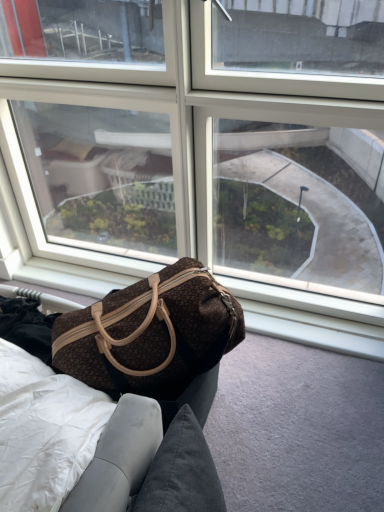
Question: Considering the relative sizes of brown textured fabric bag at center and brown fabric bag at lower left in the image provided, is brown textured fabric bag at center shorter than brown fabric bag at lower left?

Choices:
 (A) yes
 (B) no

Answer: (B)

Question: Is brown textured fabric bag at center to the left of brown fabric bag at lower left from the viewer's perspective?

Choices:
 (A) yes
 (B) no

Answer: (A)

Question: Can you confirm if brown textured fabric bag at center is thinner than brown fabric bag at lower left?

Choices:
 (A) yes
 (B) no

Answer: (A)

Question: Is brown textured fabric bag at center positioned before brown fabric bag at lower left?

Choices:
 (A) no
 (B) yes

Answer: (B)

Question: Does brown textured fabric bag at center have a larger size compared to brown fabric bag at lower left?

Choices:
 (A) no
 (B) yes

Answer: (B)

Question: From a real-world perspective, is transparent glass window at center physically located above or below brown textured fabric bag at center?

Choices:
 (A) above
 (B) below

Answer: (A)

Question: In terms of width, does transparent glass window at center look wider or thinner when compared to brown textured fabric bag at center?

Choices:
 (A) wide
 (B) thin

Answer: (B)

Question: Is point (168, 28) positioned closer to the camera than point (203, 301)?

Choices:
 (A) closer
 (B) farther

Answer: (B)

Question: From the image's perspective, is transparent glass window at center located above or below brown textured fabric bag at center?

Choices:
 (A) below
 (B) above

Answer: (B)

Question: Would you say brown fabric bag at lower left is inside or outside transparent glass window at center?

Choices:
 (A) inside
 (B) outside

Answer: (B)

Question: Is brown fabric bag at lower left wider or thinner than transparent glass window at center?

Choices:
 (A) wide
 (B) thin

Answer: (A)

Question: Is point (157, 502) closer or farther from the camera than point (139, 145)?

Choices:
 (A) farther
 (B) closer

Answer: (B)

Question: Considering the relative positions of brown fabric bag at lower left and transparent glass window at center in the image provided, is brown fabric bag at lower left to the left or to the right of transparent glass window at center?

Choices:
 (A) right
 (B) left

Answer: (A)

Question: Considering the positions of point (130, 345) and point (46, 67), is point (130, 345) closer or farther from the camera than point (46, 67)?

Choices:
 (A) farther
 (B) closer

Answer: (B)

Question: In terms of height, does brown textured fabric bag at center look taller or shorter compared to transparent glass window at center?

Choices:
 (A) tall
 (B) short

Answer: (B)